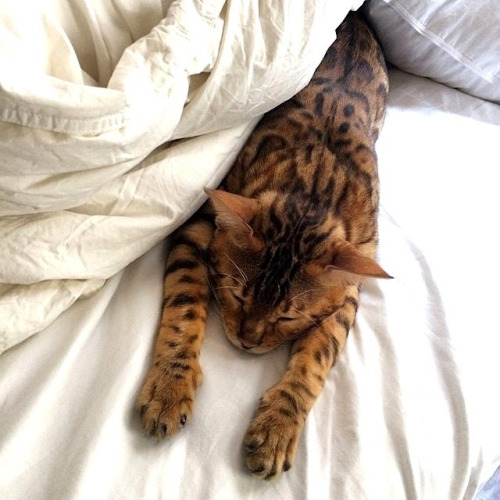
Locate an element on the screen. Image resolution: width=500 pixels, height=500 pixels. bed sheet is located at coordinates (413, 173).